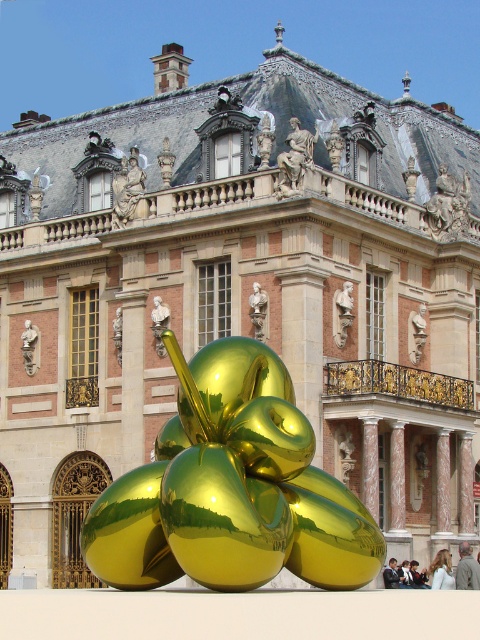
You are an art curator planning to move the matte bronze statue at upper center and the gold reflective sculpture at center to a new exhibition space. The entrance to the exhibition hall has a doorway that is 2 meters wide. If you need to move both objects through the doorway one at a time, which object would you move first to ensure both can fit through?

The matte bronze statue at upper center has a lesser width compared to gold reflective sculpture at center. Therefore, you should move the matte bronze statue at upper center first, followed by the gold reflective sculpture at center, as its narrower width ensures it can pass through the doorway, and the wider gold reflective sculpture at center can also fit since the doorway is 2 meters wide.